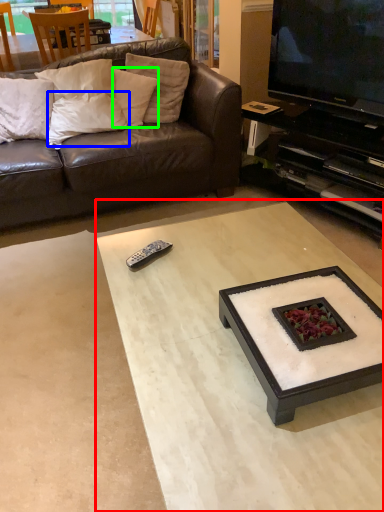
Question: Based on their relative distances, which object is farther from coffee table (highlighted by a red box)? Choose from pillow (highlighted by a blue box) and pillow (highlighted by a green box).

Choices:
 (A) pillow
 (B) pillow

Answer: (B)